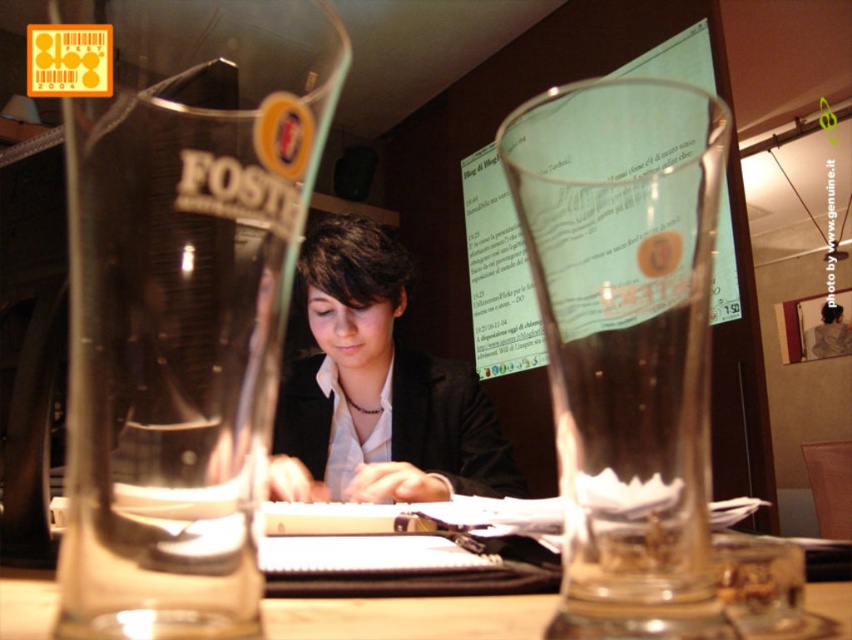
Question: Is transparent glass foster beer glass at left to the right of transparent glass at center from the viewer's perspective?

Choices:
 (A) yes
 (B) no

Answer: (B)

Question: Estimate the real-world distances between objects in this image. Which object is farther from the matte black jacket at center?

Choices:
 (A) transparent glass at center
 (B) transparent glass table at center

Answer: (B)

Question: Does transparent glass at center have a larger size compared to matte black jacket at center?

Choices:
 (A) no
 (B) yes

Answer: (A)

Question: Is transparent glass foster beer glass at left above transparent glass at center?

Choices:
 (A) yes
 (B) no

Answer: (B)

Question: Which point appears closest to the camera in this image?

Choices:
 (A) (142, 83)
 (B) (691, 234)

Answer: (A)

Question: Which is nearer to the matte black jacket at center?

Choices:
 (A) transparent glass at center
 (B) transparent glass table at center

Answer: (A)